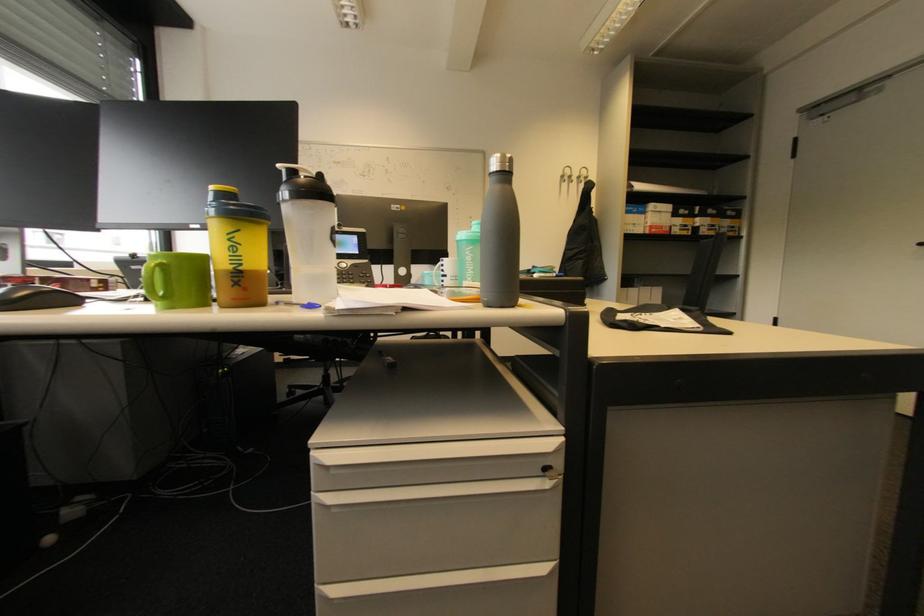
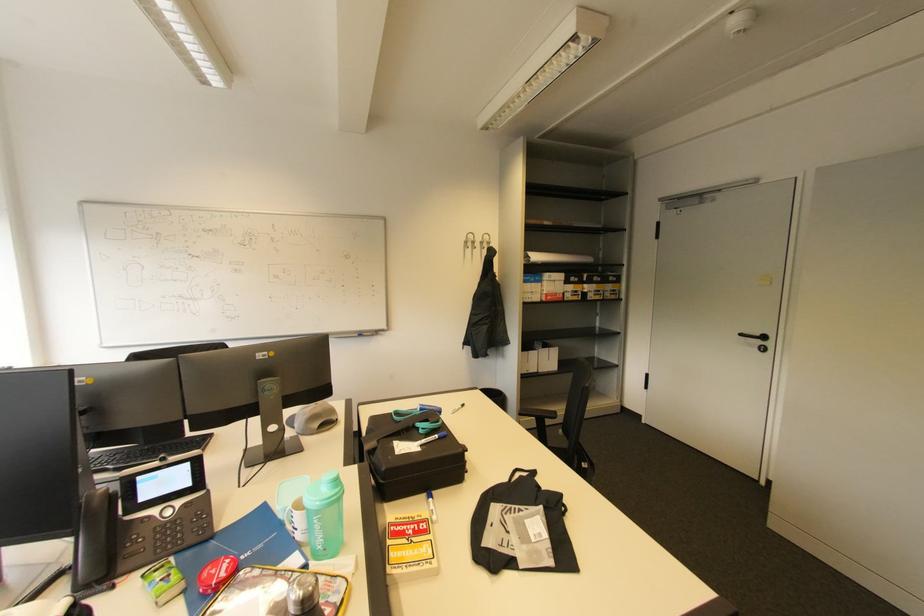
In the second image, find the point that corresponds to point (451, 277) in the first image.

(300, 531)